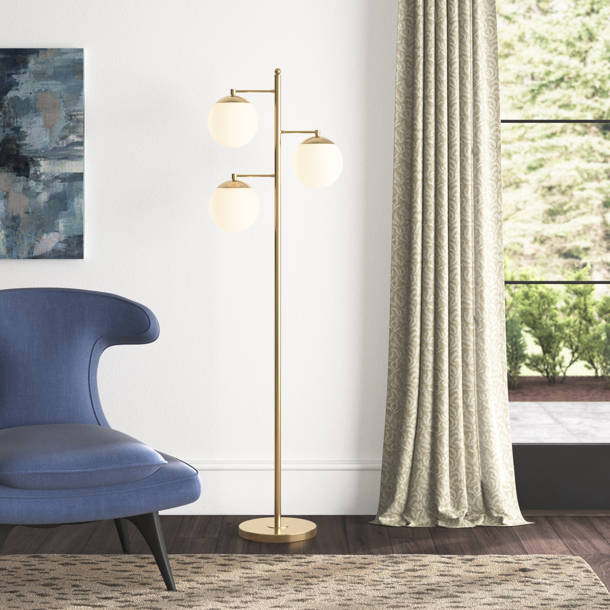
Where is `blue chair`? blue chair is located at coordinates (47, 367).